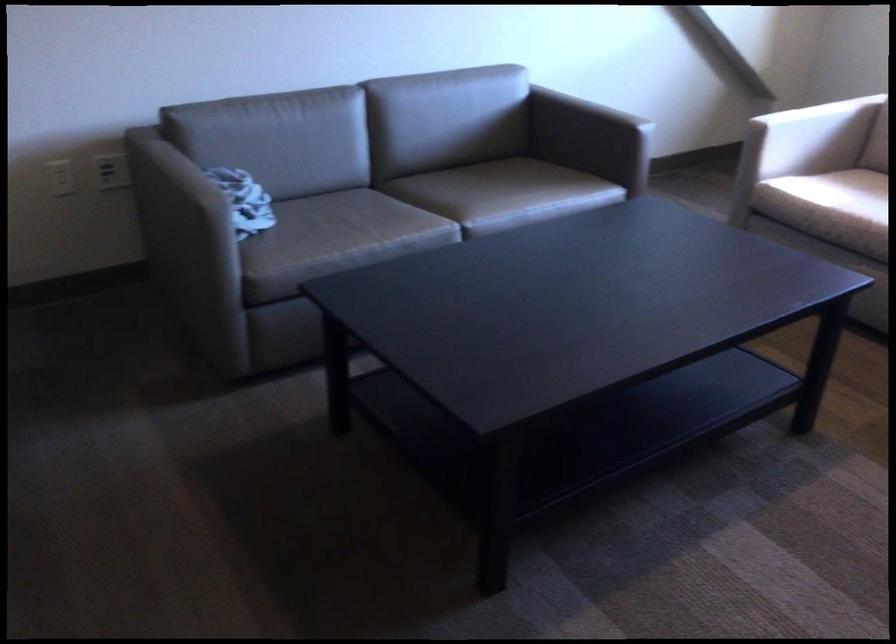
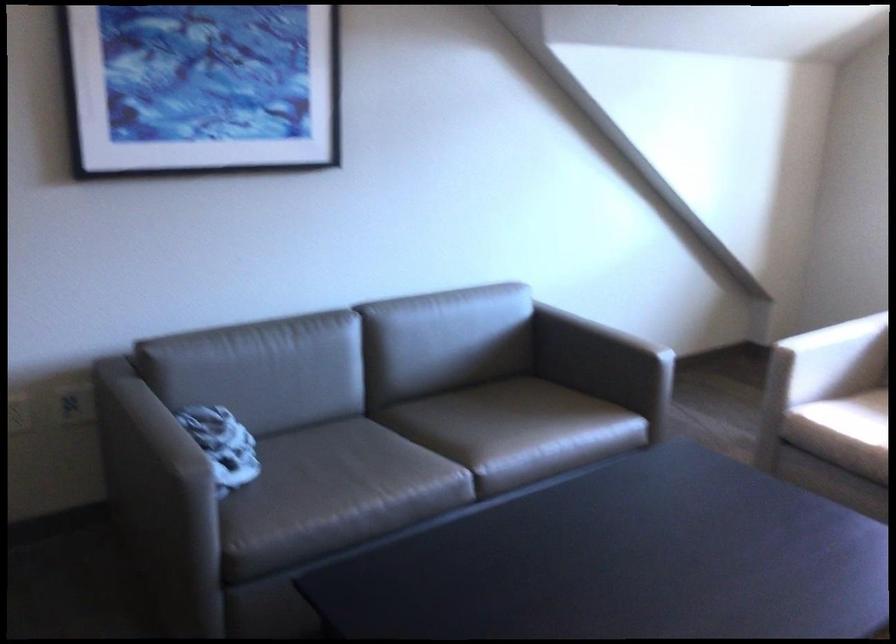
In the second image, find the point that corresponds to [183,214] in the first image.

(158, 491)